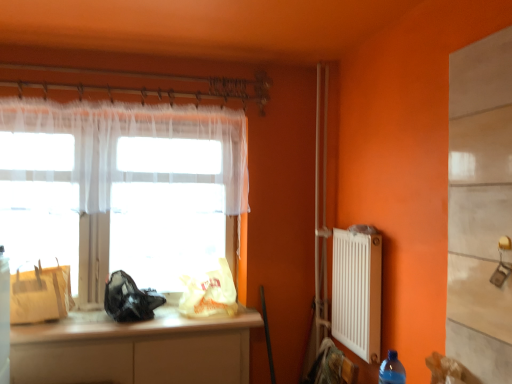
Question: Would you say blue plastic bottle at lower right is inside or outside matte yellow paper bag at left, which appears as the 3th bag when viewed from the right?

Choices:
 (A) inside
 (B) outside

Answer: (B)

Question: Considering the positions of blue plastic bottle at lower right and matte yellow paper bag at left, which appears as the 3th bag when viewed from the right, in the image, is blue plastic bottle at lower right wider or thinner than matte yellow paper bag at left, which appears as the 3th bag when viewed from the right,?

Choices:
 (A) wide
 (B) thin

Answer: (B)

Question: Which of these objects is positioned farthest from the matte yellow paper bag at left, which appears as the 3th bag when viewed from the right?

Choices:
 (A) translucent plastic bag at window, marked as the 1th bag in a right-to-left arrangement
 (B) wooden counter top at lower left
 (C) white plastic radiator at right
 (D) matte white cabinet at lower left
 (E) black matte bag at window, acting as the second bag starting from the right

Answer: (C)

Question: Which object is the farthest from the translucent plastic bag at window, the 3th bag from the left?

Choices:
 (A) black matte bag at window, acting as the second bag starting from the right
 (B) white plastic radiator at right
 (C) translucent fabric at left
 (D) wooden counter top at lower left
 (E) matte white cabinet at lower left

Answer: (B)